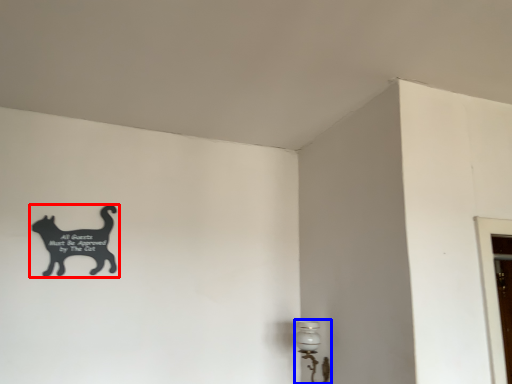
Question: Which object is further to the camera taking this photo, cat (highlighted by a red box) or lamp (highlighted by a blue box)?

Choices:
 (A) cat
 (B) lamp

Answer: (A)